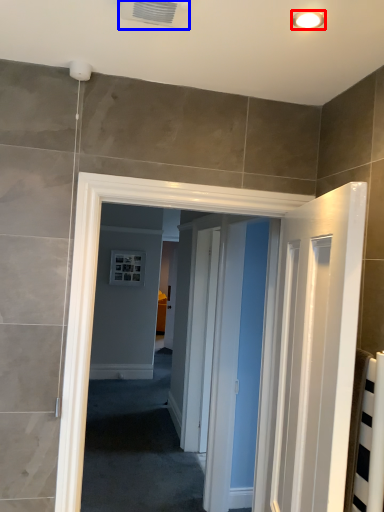
Question: Which point is closer to the camera, light fixture (highlighted by a red box) or air conditioning (highlighted by a blue box)?

Choices:
 (A) light fixture
 (B) air conditioning

Answer: (B)